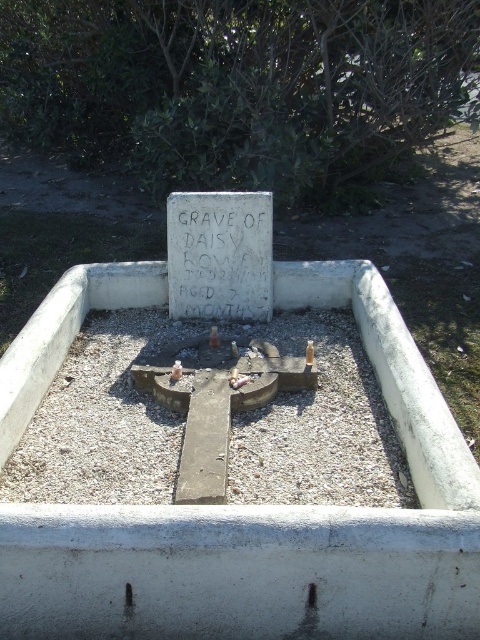
Question: Is gray gravel at center in front of white stone plaque at center?

Choices:
 (A) yes
 (B) no

Answer: (A)

Question: Among these points, which one is farthest from the camera?

Choices:
 (A) (462, 628)
 (B) (187, 253)
 (C) (277, 460)

Answer: (B)

Question: Can you confirm if gray gravel at center is thinner than white stone plaque at center?

Choices:
 (A) yes
 (B) no

Answer: (B)

Question: Among these points, which one is farthest from the camera?

Choices:
 (A) (356, 339)
 (B) (248, 221)

Answer: (A)

Question: Is gray gravel at center thinner than white stone plaque at center?

Choices:
 (A) no
 (B) yes

Answer: (A)

Question: Which object is the closest to the gray gravel at center?

Choices:
 (A) white stone plaque at center
 (B) white concrete cross at center

Answer: (B)